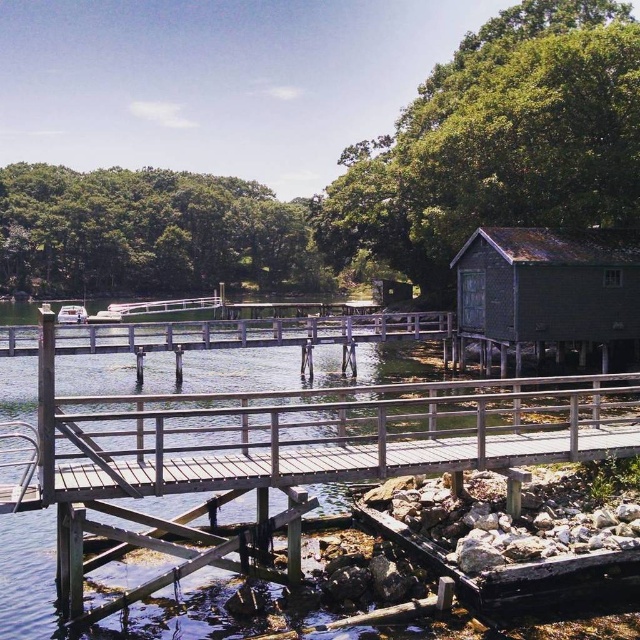
Is white plastic boat at center below white matte boat at center?

Incorrect, white plastic boat at center is not positioned below white matte boat at center.

Does white plastic boat at center have a larger size compared to white matte boat at center?

Indeed, white plastic boat at center has a larger size compared to white matte boat at center.

Which is behind, point (83, 310) or point (112, 321)?

Positioned behind is point (83, 310).

In order to click on white plastic boat at center in this screenshot , I will do `click(72, 314)`.